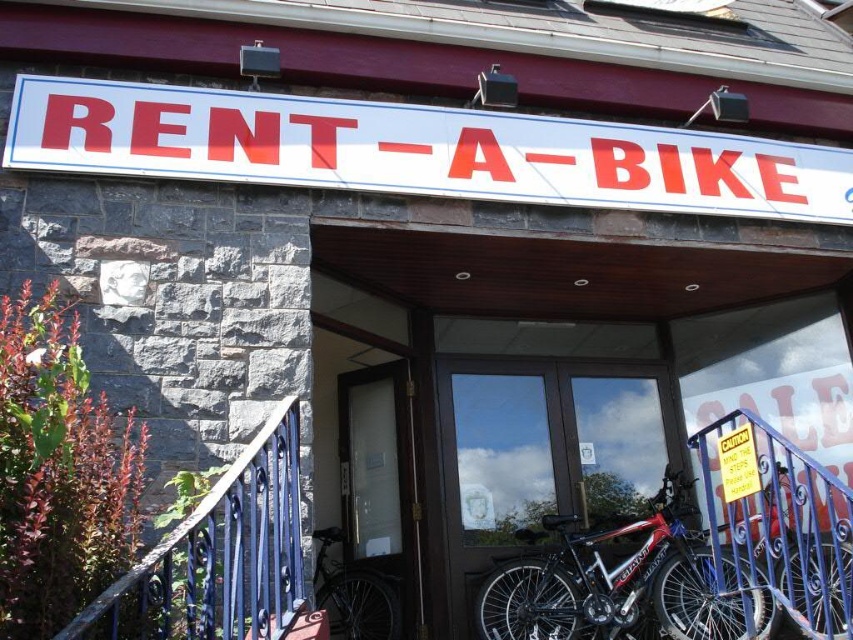
Question: Does black wrought iron railing at lower left appear over transparent glass door at center?

Choices:
 (A) yes
 (B) no

Answer: (A)

Question: Which object is closer to the camera taking this photo?

Choices:
 (A) black wrought iron railing at lower left
 (B) shiny metallic bicycle at center
 (C) blue metal rail at lower right
 (D) yellow paper caution sign at center

Answer: (A)

Question: Is black wrought iron railing at lower left wider than blue metal rail at lower right?

Choices:
 (A) yes
 (B) no

Answer: (B)

Question: Which of the following is the farthest from the observer?

Choices:
 (A) (735, 189)
 (B) (685, 556)
 (C) (724, 461)

Answer: (A)

Question: Does white plastic sign at upper center have a lesser width compared to yellow paper caution sign at center?

Choices:
 (A) no
 (B) yes

Answer: (A)

Question: Which of the following is the farthest from the observer?

Choices:
 (A) [x=838, y=570]
 (B) [x=746, y=426]
 (C) [x=206, y=561]
 (D) [x=561, y=588]

Answer: (D)